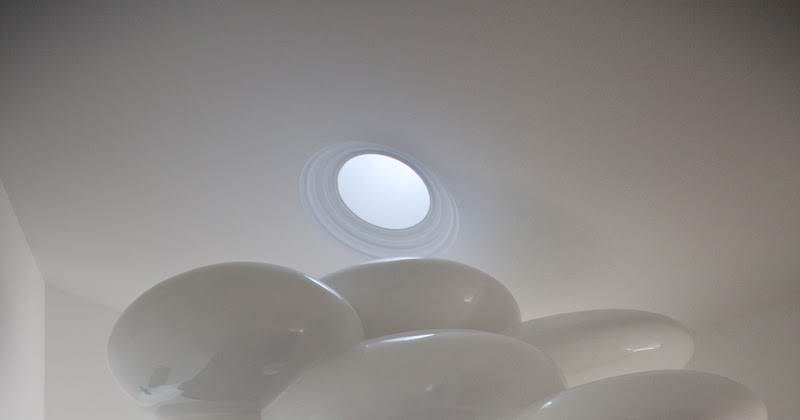
You are a GUI agent. You are given a task and a screenshot of the screen. Output one action in this format:
    pyautogui.click(x=<x>, y=<y>)
    Task: Click on the window
    The width and height of the screenshot is (800, 420).
    Given the screenshot: What is the action you would take?
    pyautogui.click(x=382, y=192)